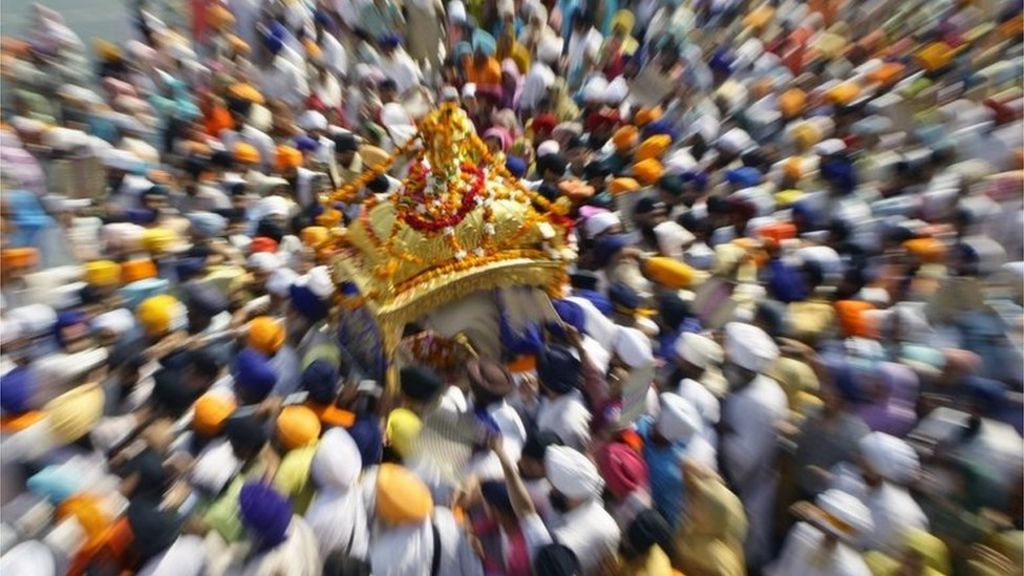
The width and height of the screenshot is (1024, 576). What are the coordinates of `white cloth` in the screenshot? It's located at (470, 313).